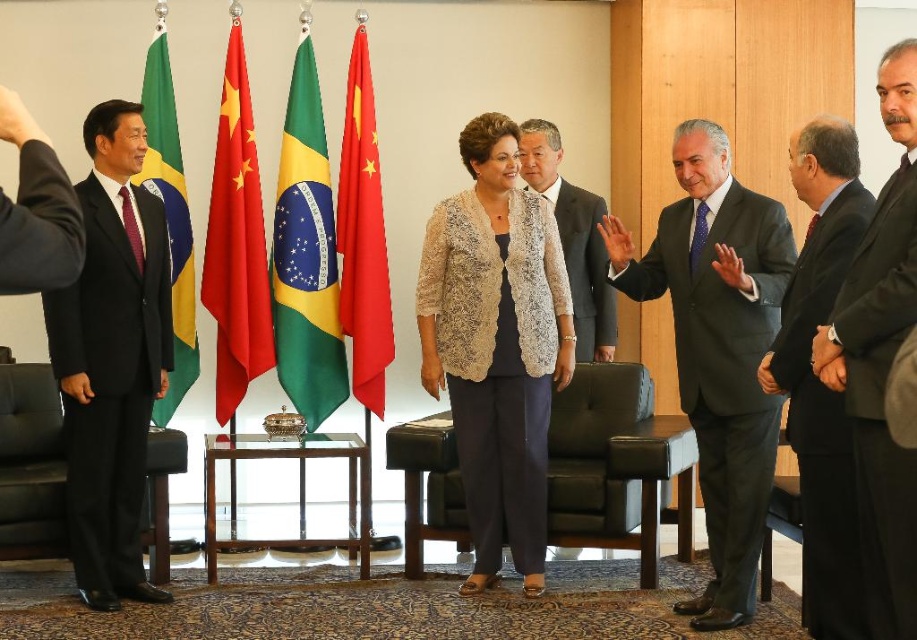
Can you confirm if lace fabric jacket at center is thinner than green fabric flag at left?

No, lace fabric jacket at center is not thinner than green fabric flag at left.

Measure the distance between point (496, 131) and camera.

Point (496, 131) and camera are 4.11 meters apart from each other.

Does point (461, 228) come farther from viewer compared to point (164, 83)?

No, (461, 228) is closer to viewer.

The height and width of the screenshot is (640, 917). Identify the location of lace fabric jacket at center. (496, 346).

Is point (53, 356) in front of point (794, 369)?

No, it is behind (794, 369).

Can you confirm if black wool suit at left is positioned to the right of dark gray suit at right?

In fact, black wool suit at left is to the left of dark gray suit at right.

Who is more distant from viewer, (x=146, y=346) or (x=827, y=228)?

Positioned behind is point (x=146, y=346).

What are the coordinates of `black wool suit at left` in the screenshot? It's located at (111, 380).

Between point (228, 227) and point (569, 225), which one is positioned behind?

The point (569, 225) is behind.

Can you confirm if red glossy flag at center is positioned to the left of light beige textured blazer at center?

Correct, you'll find red glossy flag at center to the left of light beige textured blazer at center.

Who is more forward, (234, 19) or (571, 195)?

Point (234, 19)

What are the coordinates of `red glossy flag at center` in the screenshot? It's located at (236, 243).